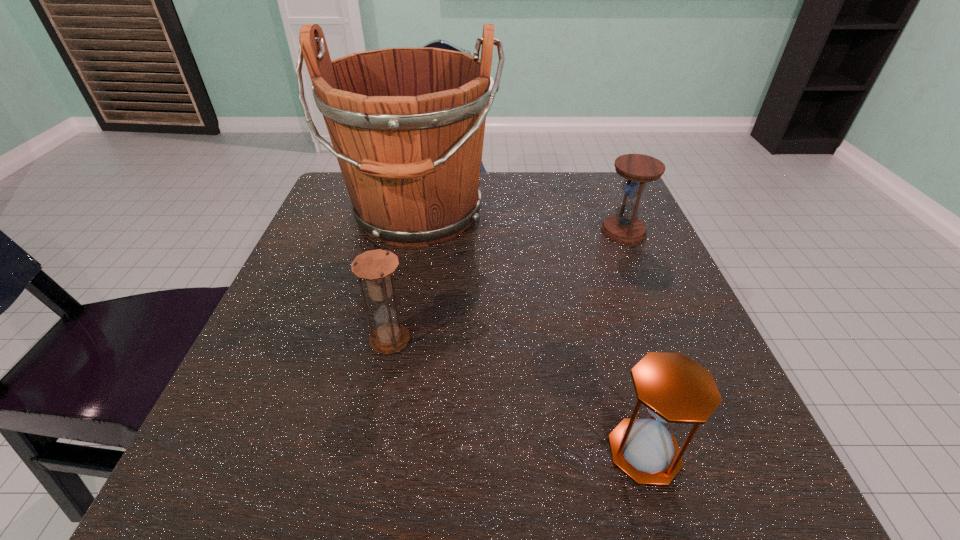
Find the location of `bucket`. bucket is located at coordinates (407, 125).

Identify the location of the second farthest hourglass. This screenshot has height=540, width=960. (376, 267).

Image resolution: width=960 pixels, height=540 pixels. Find the location of `the third farthest object`. the third farthest object is located at coordinates (376, 267).

You are a GUI agent. You are given a task and a screenshot of the screen. Output one action in this format:
    pyautogui.click(x=<x>, y=<y>)
    Task: Click on the rightmost object
    This screenshot has height=540, width=960.
    Given the screenshot: What is the action you would take?
    pyautogui.click(x=624, y=227)

The height and width of the screenshot is (540, 960). I want to click on the rightmost hourglass, so click(x=624, y=227).

Find the location of `the nearest hourglass`. the nearest hourglass is located at coordinates (675, 389).

This screenshot has height=540, width=960. I want to click on the third object from left to right, so click(675, 389).

The height and width of the screenshot is (540, 960). What are the coordinates of `vacant point located with the handle on the side of the tallest object` in the screenshot? It's located at (394, 338).

This screenshot has height=540, width=960. What are the coordinates of `vacant space located on the back of the third farthest object` in the screenshot? It's located at (403, 275).

Where is `blank space located 0.330m on the left of the farthest hourglass`? The width and height of the screenshot is (960, 540). blank space located 0.330m on the left of the farthest hourglass is located at coordinates (448, 231).